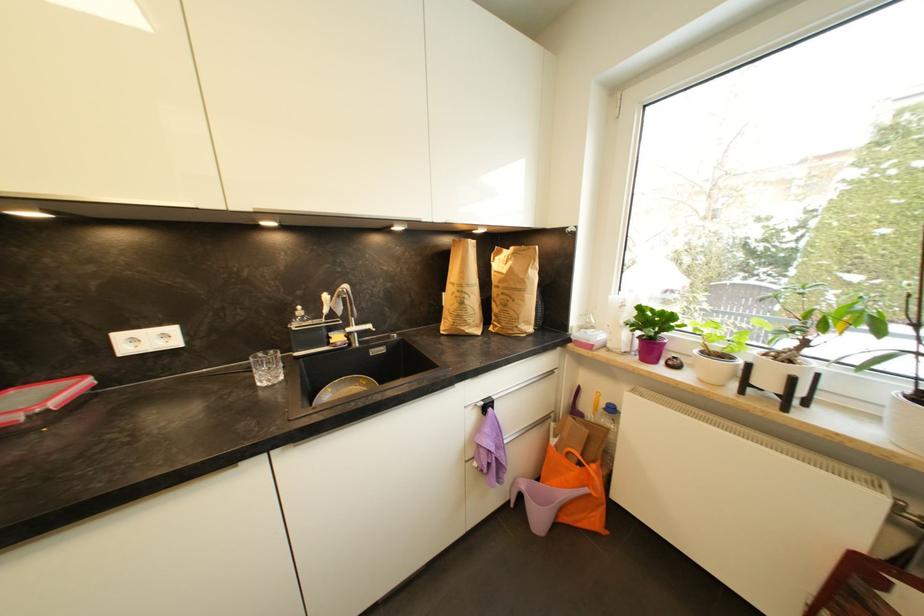
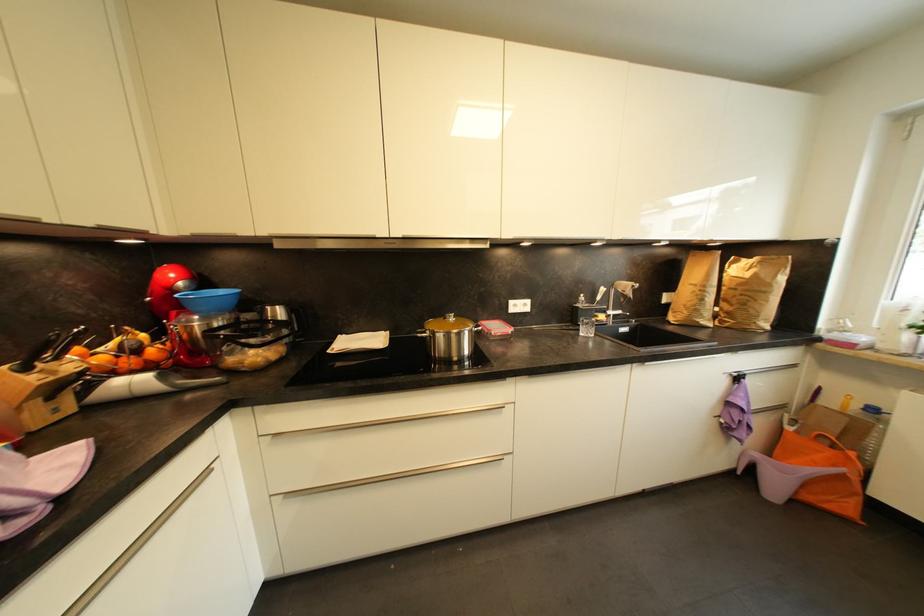
The images are taken continuously from a first-person perspective. In which direction are you moving?

The cameraman moved toward left, backward.